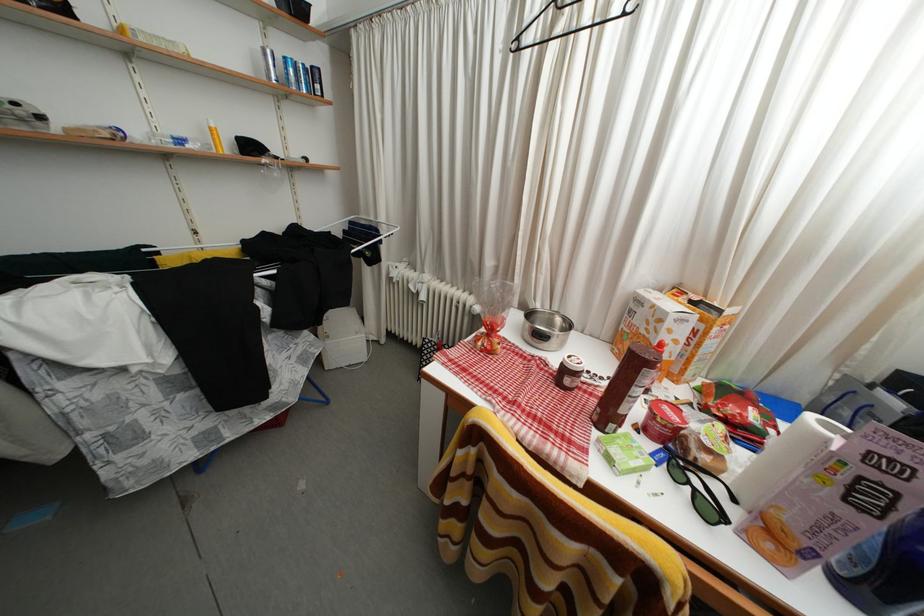
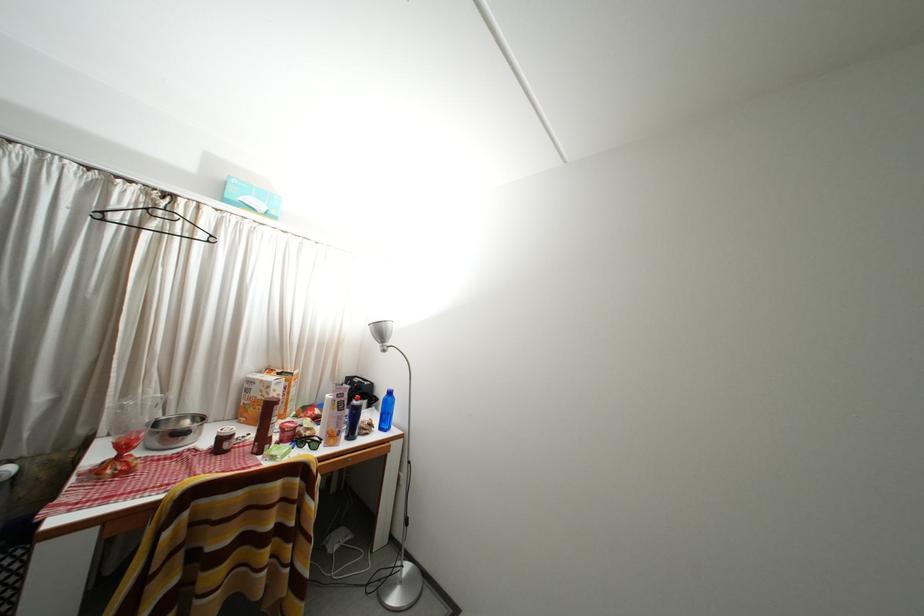
Where in the second image is the point corresponding to point 647,306 from the first image?

(259, 387)